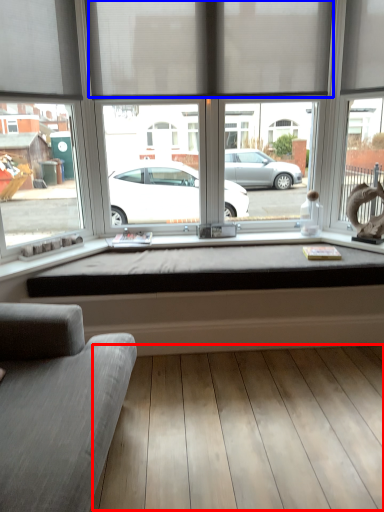
Question: Which of the following is the farthest to the observer, plank (highlighted by a red box) or curtain (highlighted by a blue box)?

Choices:
 (A) plank
 (B) curtain

Answer: (B)